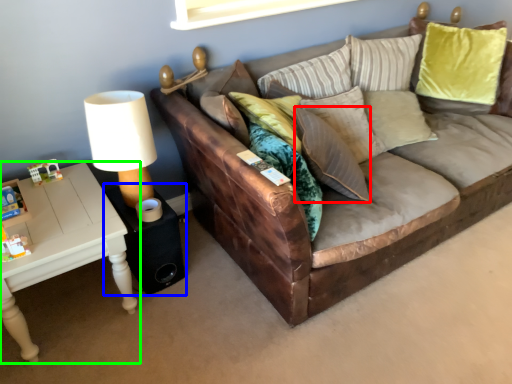
Question: Estimate the real-world distances between objects in this image. Which object is closer to pillow (highlighted by a red box), side table (highlighted by a blue box) or table (highlighted by a green box)?

Choices:
 (A) side table
 (B) table

Answer: (A)